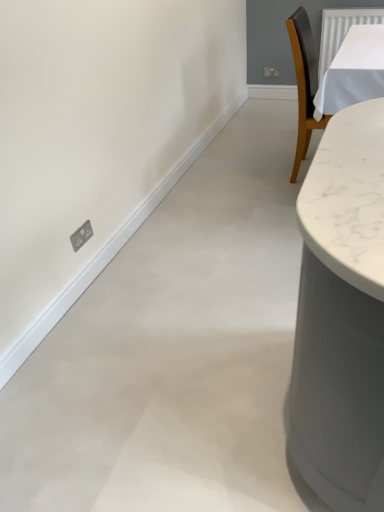
Question: Should I look upward or downward to see white matte wall at left?

Choices:
 (A) down
 (B) up

Answer: (B)

Question: Could white matte wall at left be considered to be inside satin silver socket at lower left?

Choices:
 (A) yes
 (B) no

Answer: (B)

Question: Does satin silver socket at lower left have a greater width compared to white matte wall at left?

Choices:
 (A) no
 (B) yes

Answer: (A)

Question: Can you confirm if satin silver socket at lower left is thinner than white matte wall at left?

Choices:
 (A) no
 (B) yes

Answer: (B)

Question: Can we say satin silver socket at lower left lies outside white matte wall at left?

Choices:
 (A) yes
 (B) no

Answer: (A)

Question: From the image's perspective, is satin silver socket at lower left above white matte wall at left?

Choices:
 (A) no
 (B) yes

Answer: (A)

Question: Is satin silver socket at lower left positioned behind white matte wall at left?

Choices:
 (A) no
 (B) yes

Answer: (B)

Question: Is white matte wall at left shorter than satin silver socket at lower left?

Choices:
 (A) no
 (B) yes

Answer: (A)

Question: Is white matte wall at left positioned beyond the bounds of satin silver socket at lower left?

Choices:
 (A) no
 (B) yes

Answer: (B)

Question: Is white matte wall at left turned away from satin silver socket at lower left?

Choices:
 (A) no
 (B) yes

Answer: (A)

Question: Could you tell me if white matte wall at left is facing satin silver socket at lower left?

Choices:
 (A) yes
 (B) no

Answer: (B)

Question: From the image's perspective, does white matte wall at left appear lower than satin silver socket at lower left?

Choices:
 (A) no
 (B) yes

Answer: (A)

Question: Is white matte wall at left behind satin silver socket at lower left?

Choices:
 (A) yes
 (B) no

Answer: (B)

Question: From the image's perspective, is white matte wall at left located above or below satin silver socket at lower left?

Choices:
 (A) below
 (B) above

Answer: (B)